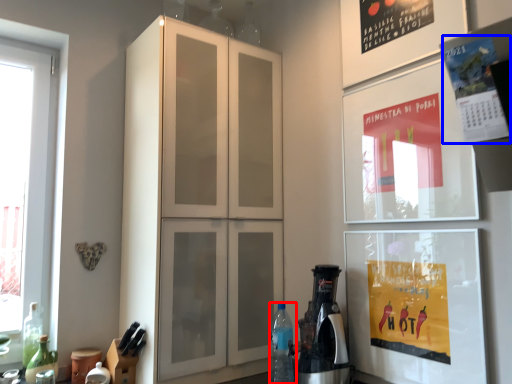
Question: Which point is closer to the camera, bottle (highlighted by a red box) or poster (highlighted by a blue box)?

Choices:
 (A) bottle
 (B) poster

Answer: (B)